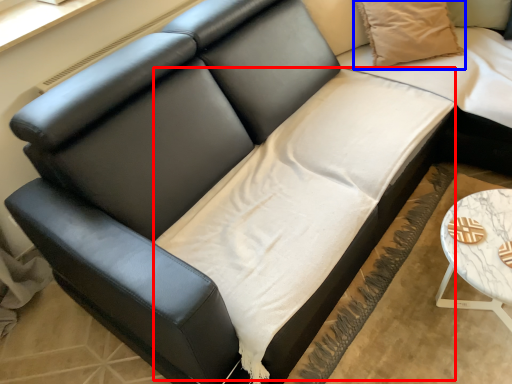
Question: Which object appears closest to the camera in this image, sheet (highlighted by a red box) or pillow (highlighted by a blue box)?

Choices:
 (A) sheet
 (B) pillow

Answer: (A)